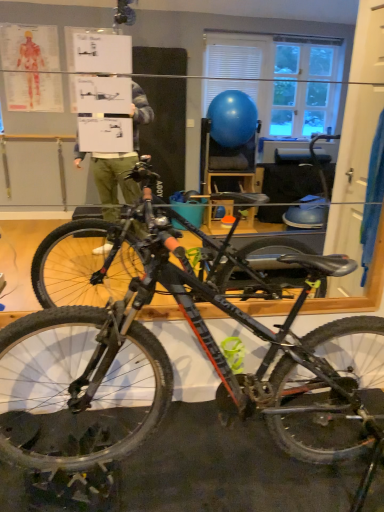
Question: Can you confirm if black rubber tire at lower right is bigger than shiny metallic bicycle at center?

Choices:
 (A) no
 (B) yes

Answer: (A)

Question: Considering the relative positions of black rubber tire at lower right and shiny metallic bicycle at center in the image provided, is black rubber tire at lower right behind shiny metallic bicycle at center?

Choices:
 (A) no
 (B) yes

Answer: (B)

Question: Could shiny metallic bicycle at center be considered to be inside black rubber tire at lower right?

Choices:
 (A) yes
 (B) no

Answer: (B)

Question: Would you say black rubber tire at lower right is a long distance from shiny metallic bicycle at center?

Choices:
 (A) no
 (B) yes

Answer: (A)

Question: Does black rubber tire at lower right come in front of shiny metallic bicycle at center?

Choices:
 (A) yes
 (B) no

Answer: (B)

Question: Can you confirm if black rubber tire at lower right is positioned to the left of shiny metallic bicycle at center?

Choices:
 (A) no
 (B) yes

Answer: (A)

Question: Is shiny metallic bicycle at center positioned with its back to black rubber tire at lower right?

Choices:
 (A) no
 (B) yes

Answer: (B)

Question: Considering the relative sizes of shiny metallic bicycle at center and black rubber tire at lower right in the image provided, is shiny metallic bicycle at center shorter than black rubber tire at lower right?

Choices:
 (A) yes
 (B) no

Answer: (B)

Question: Is the position of shiny metallic bicycle at center less distant than that of black rubber tire at lower right?

Choices:
 (A) yes
 (B) no

Answer: (A)

Question: Can you confirm if shiny metallic bicycle at center is wider than black rubber tire at lower right?

Choices:
 (A) yes
 (B) no

Answer: (A)

Question: From the image's perspective, is shiny metallic bicycle at center located beneath black rubber tire at lower right?

Choices:
 (A) yes
 (B) no

Answer: (B)

Question: Considering the relative sizes of shiny metallic bicycle at center and black rubber tire at lower right in the image provided, is shiny metallic bicycle at center taller than black rubber tire at lower right?

Choices:
 (A) no
 (B) yes

Answer: (B)

Question: Is point (299, 440) positioned closer to the camera than point (228, 384)?

Choices:
 (A) closer
 (B) farther

Answer: (B)